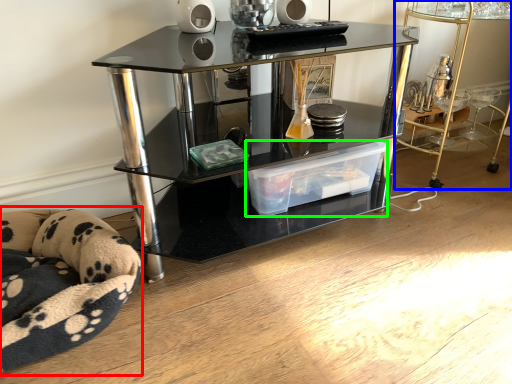
Question: Considering the real-world distances, which object is farthest from swivel chair (highlighted by a red box)? table (highlighted by a blue box) or storage box (highlighted by a green box)?

Choices:
 (A) table
 (B) storage box

Answer: (A)